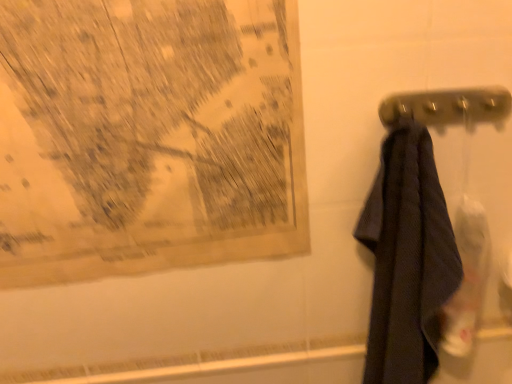
Question: From a real-world perspective, is metallic gray towel bar at right on top of black textured towel at right?

Choices:
 (A) yes
 (B) no

Answer: (A)

Question: From a real-world perspective, does metallic gray towel bar at right sit lower than black textured towel at right?

Choices:
 (A) no
 (B) yes

Answer: (A)

Question: Is black textured towel at right located within metallic gray towel bar at right?

Choices:
 (A) no
 (B) yes

Answer: (A)

Question: Does metallic gray towel bar at right turn towards black textured towel at right?

Choices:
 (A) no
 (B) yes

Answer: (B)

Question: Would you consider metallic gray towel bar at right to be distant from black textured towel at right?

Choices:
 (A) yes
 (B) no

Answer: (B)

Question: Does metallic gray towel bar at right have a larger size compared to black textured towel at right?

Choices:
 (A) no
 (B) yes

Answer: (A)

Question: From a real-world perspective, is yellowed paper map at upper left beneath metallic gray towel bar at right?

Choices:
 (A) no
 (B) yes

Answer: (B)

Question: From the image's perspective, is yellowed paper map at upper left located beneath metallic gray towel bar at right?

Choices:
 (A) yes
 (B) no

Answer: (A)

Question: Considering the relative sizes of yellowed paper map at upper left and metallic gray towel bar at right in the image provided, is yellowed paper map at upper left thinner than metallic gray towel bar at right?

Choices:
 (A) no
 (B) yes

Answer: (B)

Question: From the image's perspective, would you say yellowed paper map at upper left is positioned over metallic gray towel bar at right?

Choices:
 (A) no
 (B) yes

Answer: (A)

Question: Is there a large distance between yellowed paper map at upper left and metallic gray towel bar at right?

Choices:
 (A) yes
 (B) no

Answer: (B)

Question: Does yellowed paper map at upper left appear on the right side of metallic gray towel bar at right?

Choices:
 (A) no
 (B) yes

Answer: (A)

Question: From a real-world perspective, is yellowed paper map at upper left beneath black textured towel at right?

Choices:
 (A) yes
 (B) no

Answer: (B)